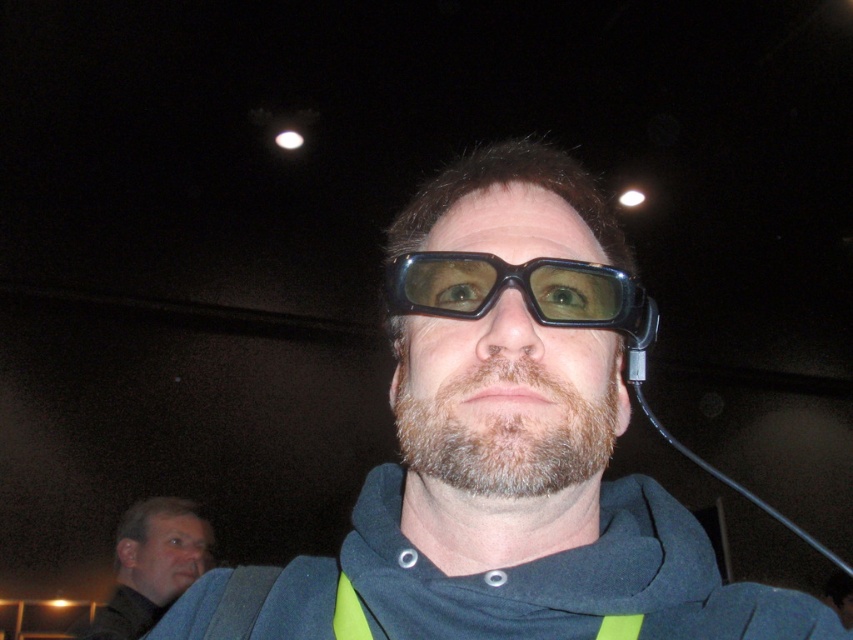
Question: Considering the relative positions of black plastic glasses at center and brown fuzzy beard at center in the image provided, where is black plastic glasses at center located with respect to brown fuzzy beard at center?

Choices:
 (A) left
 (B) right

Answer: (B)

Question: Which object is positioned farthest from the black plastic glasses at center?

Choices:
 (A) transparent plastic lens at upper center
 (B) matte black glasses at lower left
 (C) brown fuzzy beard at center

Answer: (A)

Question: Does black plastic glasses at center have a larger size compared to brown fuzzy beard at center?

Choices:
 (A) no
 (B) yes

Answer: (B)

Question: Does black plastic glasses at center have a lesser width compared to transparent plastic lens at upper center?

Choices:
 (A) no
 (B) yes

Answer: (A)

Question: Which point appears farthest from the camera in this image?

Choices:
 (A) pyautogui.click(x=471, y=300)
 (B) pyautogui.click(x=581, y=592)
 (C) pyautogui.click(x=160, y=534)
 (D) pyautogui.click(x=511, y=378)

Answer: (C)

Question: Which of these objects is positioned closest to the matte black glasses at lower left?

Choices:
 (A) brown fuzzy beard at center
 (B) black plastic glasses at center
 (C) black plastic goggles at center

Answer: (B)